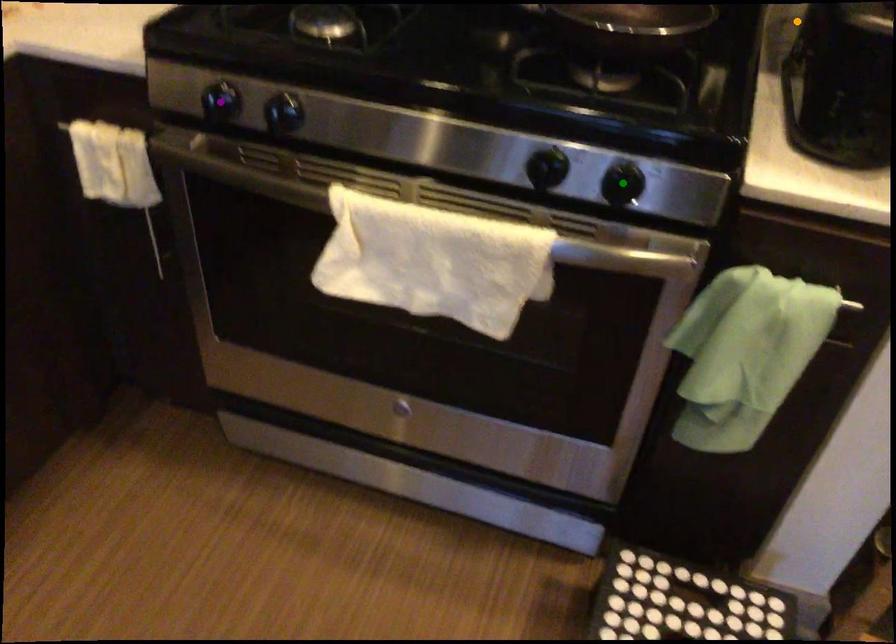
Order these from farthest to nearest:
- orange point
- green point
- purple point

orange point
purple point
green point